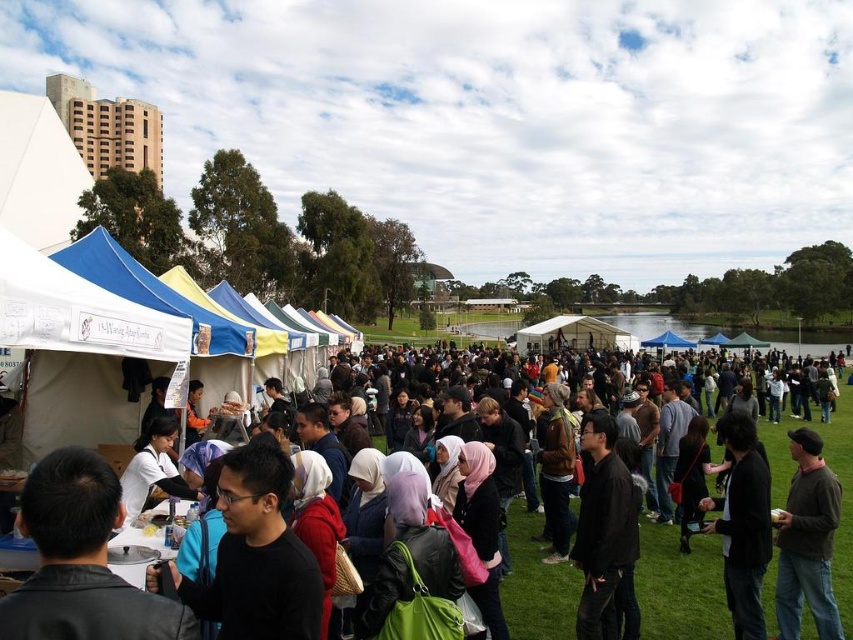
Can you confirm if brown leather jacket at lower right is taller than black matte jacket at center?

No.

Which is behind, point (788, 451) or point (596, 483)?

The point (788, 451) is behind.

What do you see at coordinates (807, 541) in the screenshot?
I see `brown leather jacket at lower right` at bounding box center [807, 541].

The image size is (853, 640). What are the coordinates of `brown leather jacket at lower right` in the screenshot? It's located at (807, 541).

Is black fabric crowd at center behind black leather jacket at lower right?

No, it is not.

The width and height of the screenshot is (853, 640). Find the location of `black fabric crowd at center`. black fabric crowd at center is located at coordinates 680,586.

Who is more forward, (517, 509) or (614, 637)?

Point (614, 637)

Who is positioned more to the right, black fabric crowd at center or black matte jacket at center?

black fabric crowd at center

Does point (727, 632) lie behind point (637, 506)?

No, (727, 632) is in front of (637, 506).

The image size is (853, 640). I want to click on black fabric crowd at center, so click(x=680, y=586).